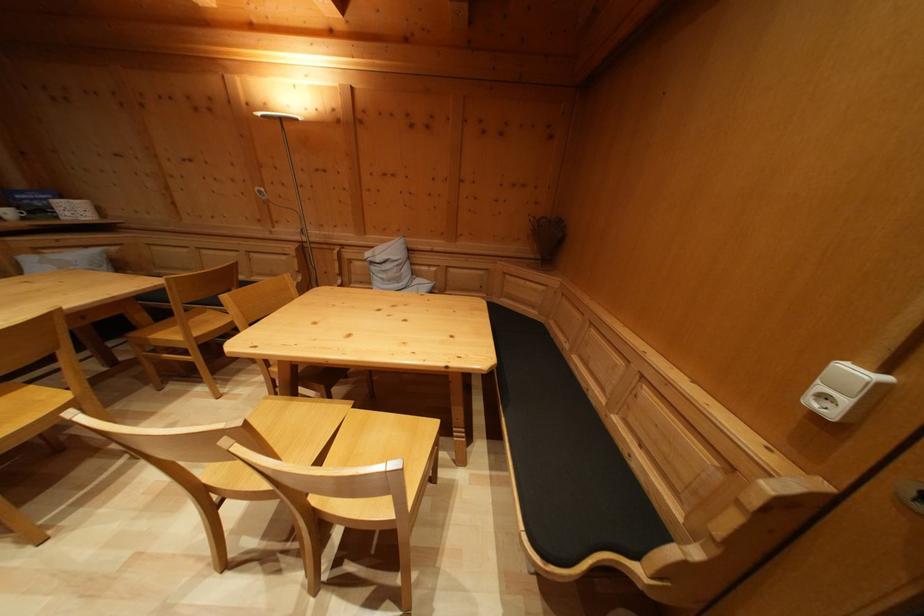
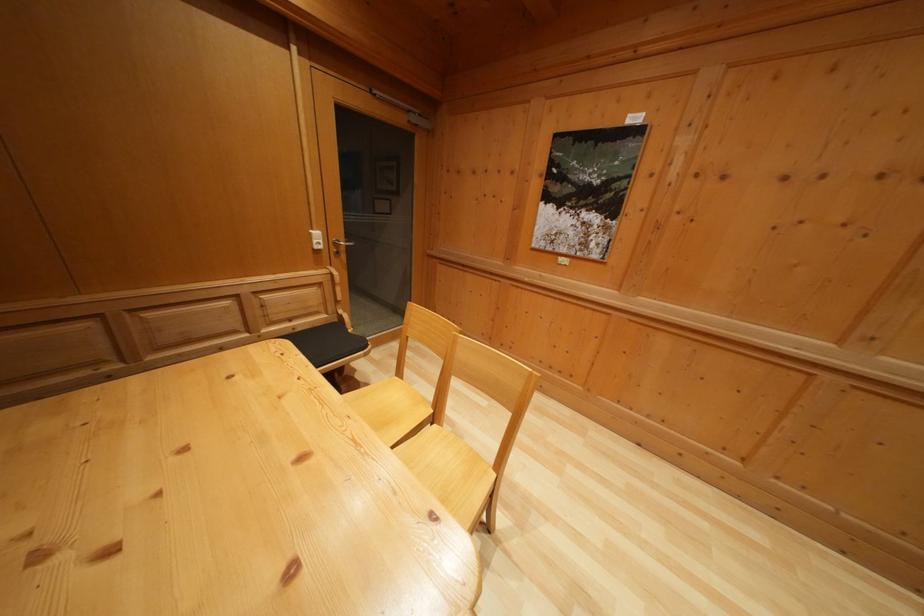
Where in the second image is the point corresponding to point 859,379 from the first image?

(322, 240)